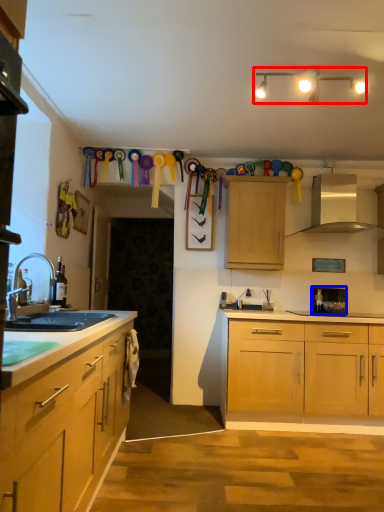
Question: Which object appears farthest to the camera in this image, lamp (highlighted by a red box) or appliance (highlighted by a blue box)?

Choices:
 (A) lamp
 (B) appliance

Answer: (B)